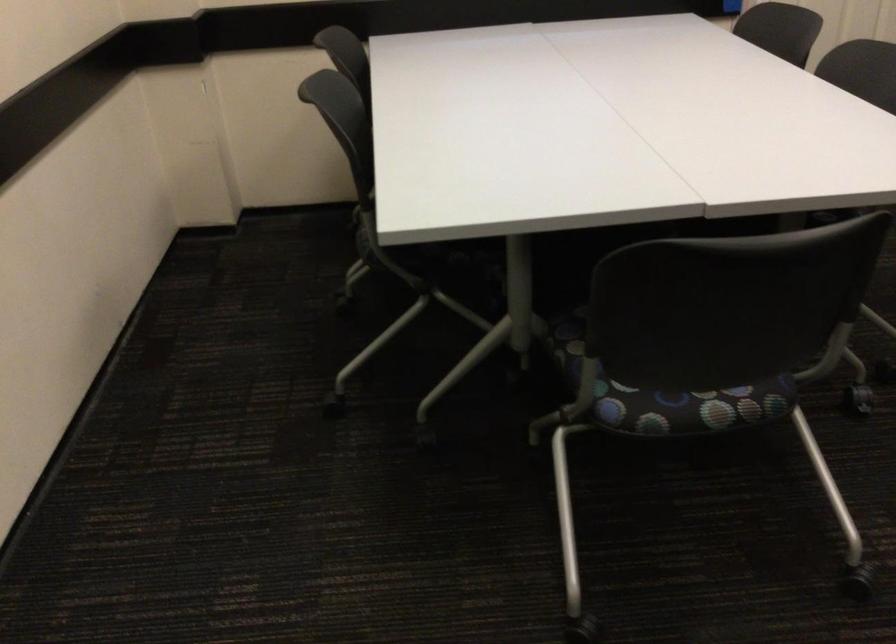
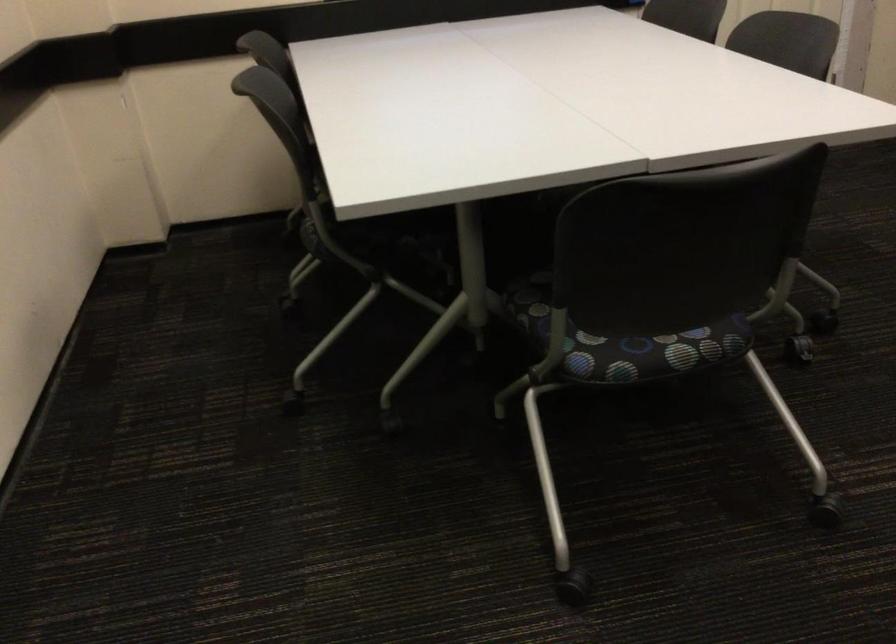
Question: The images are taken continuously from a first-person perspective. In which direction is your viewpoint rotating?

Choices:
 (A) Left
 (B) Right
 (C) Up
 (D) Down

Answer: (B)